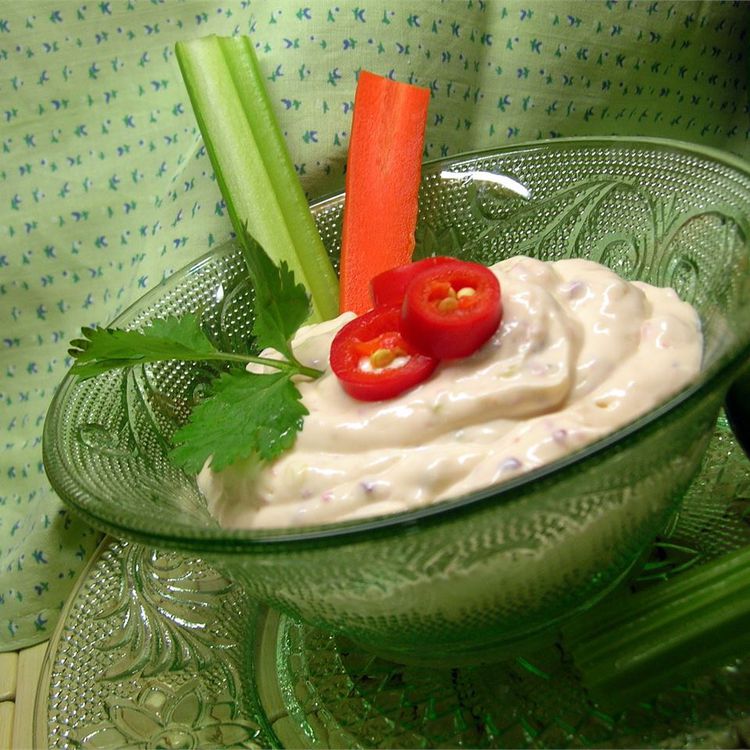
Locate an element on the screen. flower pattern on glass is located at coordinates (183, 732).